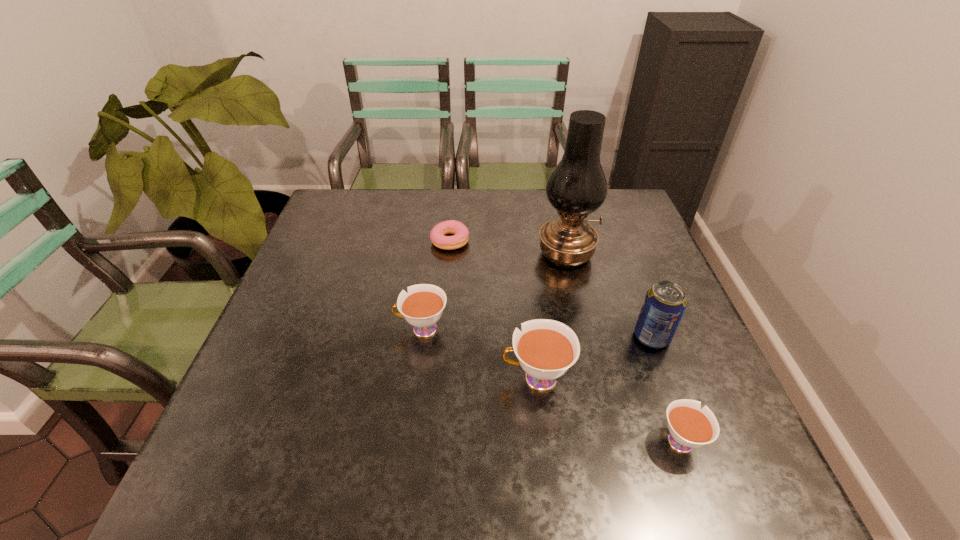
Locate an element on the screen. This screenshot has height=540, width=960. teacup identified as the second closest to the fifth shortest object is located at coordinates (546, 349).

This screenshot has width=960, height=540. I want to click on teacup that stands as the second closest to the oil lamp, so click(422, 307).

Where is `free point that satisfies the following two spatial constraints: 1. on the side of the fifth tallest object with the handle; 2. on the right side of the fifth shortest object`? The height and width of the screenshot is (540, 960). free point that satisfies the following two spatial constraints: 1. on the side of the fifth tallest object with the handle; 2. on the right side of the fifth shortest object is located at coordinates (643, 337).

Where is `vacant area in the image that satisfies the following two spatial constraints: 1. on the front side of the oil lamp; 2. on the right side of the fifth shortest object`? The height and width of the screenshot is (540, 960). vacant area in the image that satisfies the following two spatial constraints: 1. on the front side of the oil lamp; 2. on the right side of the fifth shortest object is located at coordinates coord(585,337).

The image size is (960, 540). What are the coordinates of `free space that satisfies the following two spatial constraints: 1. on the side of the soda with the handle; 2. on the right side of the farthest teacup` in the screenshot? It's located at (420, 337).

This screenshot has height=540, width=960. In order to click on vacant space that satisfies the following two spatial constraints: 1. on the side of the fourth shortest object with the handle; 2. on the side of the rightmost teacup with the handle in this screenshot , I will do `click(543, 438)`.

Where is `free space that satisfies the following two spatial constraints: 1. on the side of the farthest teacup with the handle; 2. on the back side of the second tallest object`? The width and height of the screenshot is (960, 540). free space that satisfies the following two spatial constraints: 1. on the side of the farthest teacup with the handle; 2. on the back side of the second tallest object is located at coordinates (420, 337).

The image size is (960, 540). I want to click on free space that satisfies the following two spatial constraints: 1. on the side of the second nearest teacup with the handle; 2. on the side of the rightmost teacup with the handle, so click(x=543, y=438).